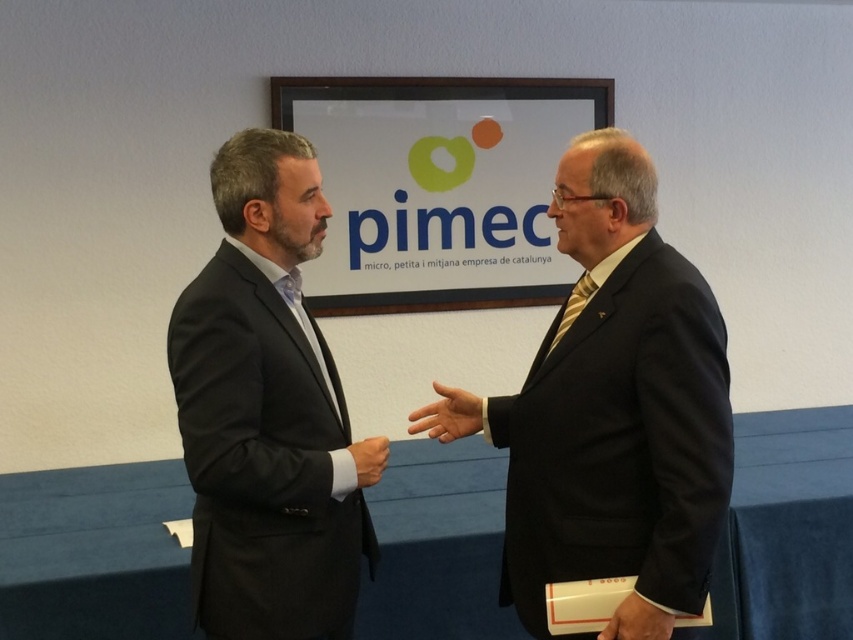
You are a security guard at a corporate event. You notice two hands at center in the image, one labeled smooth skin hand at center and the other smooth leather hand at center. Which hand should you approach for a closer inspection based on their height?

The smooth skin hand at center is taller than the smooth leather hand at center, so you should approach the smooth skin hand at center for closer inspection.

You are standing in the room where the two men are interacting. You need to locate the matte black suit at center. Where would you look?

The matte black suit at center is located at the coordinates point (616, 404).